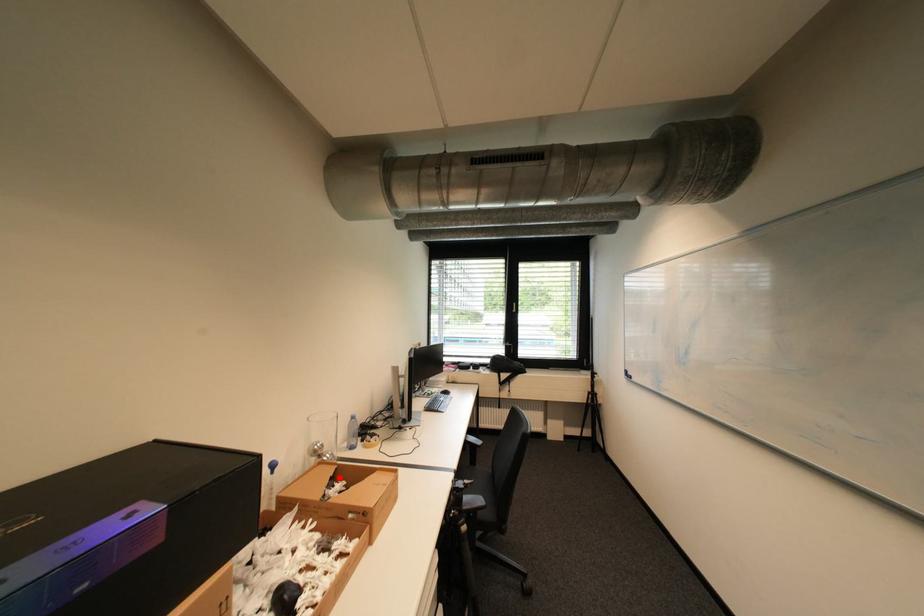
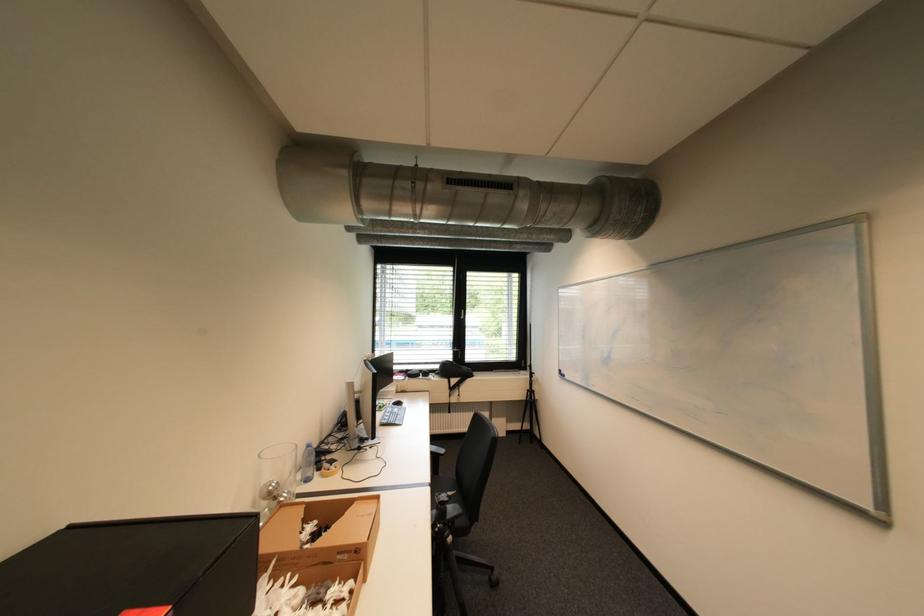
Where in the second image is the point corresponding to the highlighted location from the first image?

(311, 520)